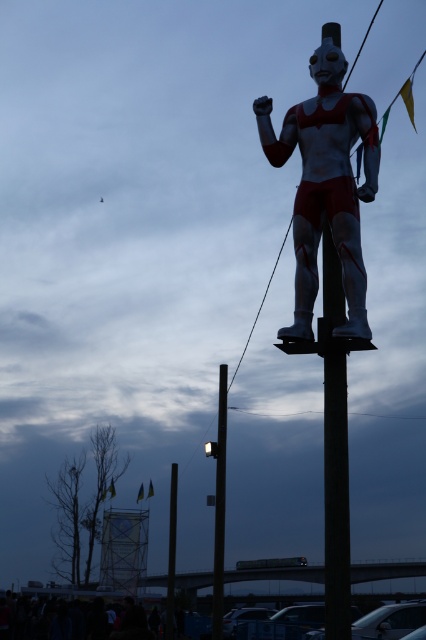
Question: Does metallic pole at center appear over black smooth pole at center?

Choices:
 (A) yes
 (B) no

Answer: (A)

Question: Considering the real-world distances, which object is closest to the metallic pole at center?

Choices:
 (A) black smooth pole at center
 (B) metallic silver figure at center

Answer: (A)

Question: Based on their relative distances, which object is nearer to the metallic pole at center?

Choices:
 (A) black smooth pole at center
 (B) smooth wood telegraph pole at center
 (C) metallic silver figure at center

Answer: (A)

Question: Among these points, which one is nearest to the camera?

Choices:
 (A) (216, 593)
 (B) (175, 497)
 (C) (337, 474)
 (D) (314, 51)

Answer: (C)

Question: Does smooth wood telegraph pole at center have a larger size compared to metallic pole at center?

Choices:
 (A) yes
 (B) no

Answer: (A)

Question: Does metallic silver figure at center appear on the left side of metallic pole at center?

Choices:
 (A) yes
 (B) no

Answer: (B)